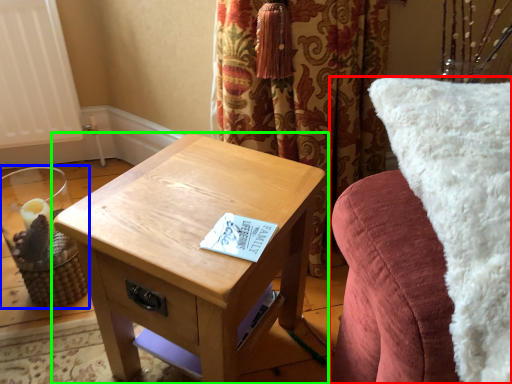
Question: Considering the real-world distances, which object is farthest from furniture (highlighted by a red box)? candle holder (highlighted by a blue box) or table (highlighted by a green box)?

Choices:
 (A) candle holder
 (B) table

Answer: (A)